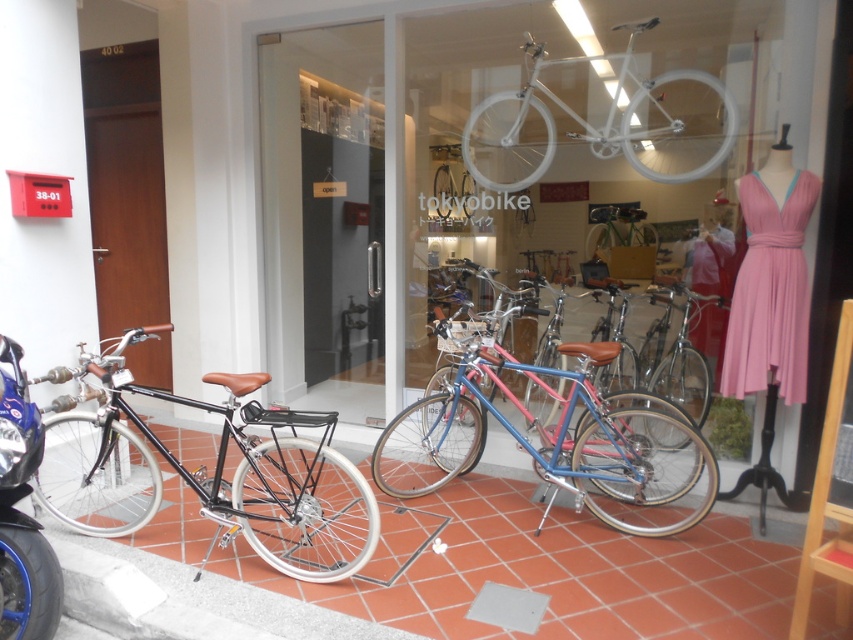
Does matte black bicycle at left appear over blue metallic bicycle at center?

No, matte black bicycle at left is not above blue metallic bicycle at center.

Does matte black bicycle at left appear on the right side of blue metallic bicycle at center?

No, matte black bicycle at left is not to the right of blue metallic bicycle at center.

Who is more forward, (289,445) or (393,486)?

Positioned in front is point (289,445).

Locate an element on the screen. The image size is (853, 640). matte black bicycle at left is located at coordinates (212, 474).

Which is above, terracotta tile pavement at lower center or matte black bicycle at left?

matte black bicycle at left is higher up.

Who is more forward, (477, 541) or (99, 481)?

Point (477, 541) is more forward.

Is point (605, 595) closer to camera compared to point (160, 394)?

Yes, point (605, 595) is closer to viewer.

I want to click on terracotta tile pavement at lower center, so click(554, 572).

Between point (677, 451) and point (708, 163), which one is positioned in front?

Point (708, 163)

Measure the distance between point (576, 385) and camera.

Point (576, 385) and camera are 10.94 feet apart from each other.

I want to click on blue metallic bicycle at center, so click(x=560, y=442).